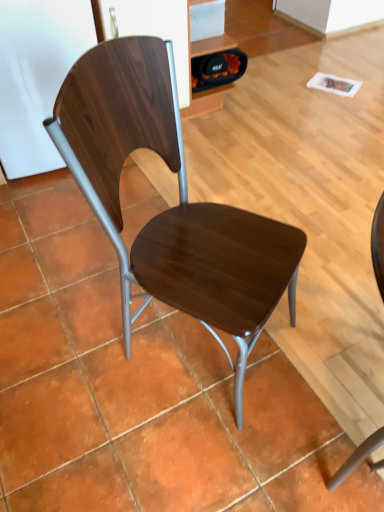
Measure the distance between shiny dark wood chair at center and camera.

shiny dark wood chair at center and camera are 77.30 centimeters apart from each other.

This screenshot has width=384, height=512. Find the location of `shiny dark wood chair at center`. shiny dark wood chair at center is located at coordinates (170, 208).

Describe the element at coordinates (170, 208) in the screenshot. I see `shiny dark wood chair at center` at that location.

Find the location of a particular element. Image resolution: width=384 pixels, height=512 pixels. shiny dark wood chair at center is located at coordinates (170, 208).